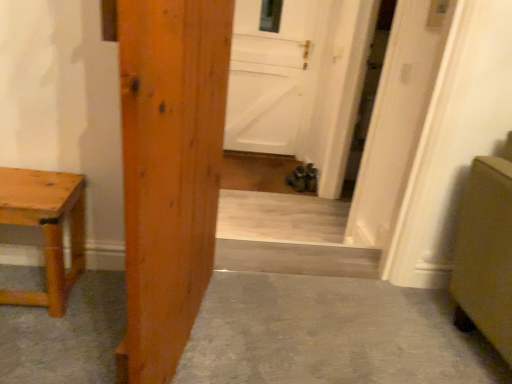
In order to click on free spot to the right of natural wood table at left in this screenshot , I will do `click(96, 306)`.